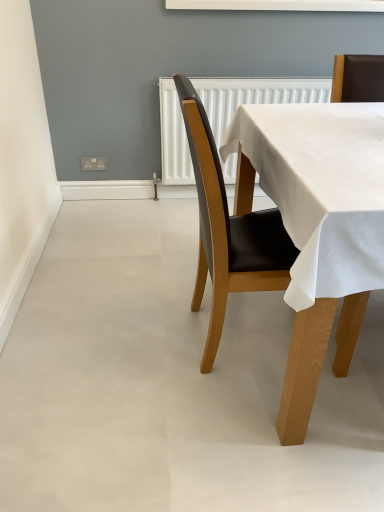
Locate an element on the screen. free region on the left part of brown leather chair at center is located at coordinates (134, 335).